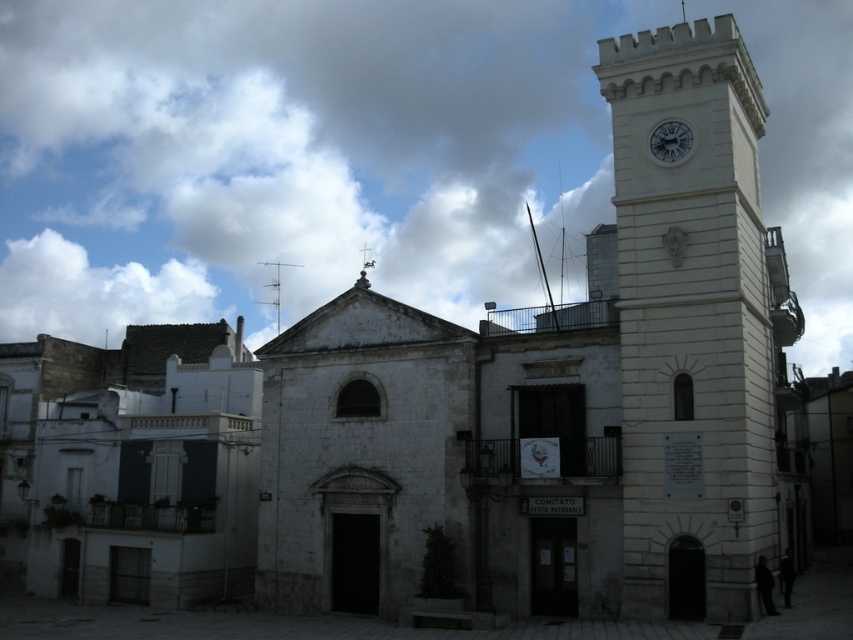
Question: Considering the real-world distances, which object is closest to the silver metallic cross at upper center?

Choices:
 (A) matte white clock at upper right
 (B) white stone clock tower at right

Answer: (A)

Question: Considering the relative positions of white stone clock tower at right and silver metallic cross at upper center in the image provided, where is white stone clock tower at right located with respect to silver metallic cross at upper center?

Choices:
 (A) left
 (B) right

Answer: (B)

Question: Among these points, which one is nearest to the camera?

Choices:
 (A) (718, 440)
 (B) (358, 284)
 (C) (682, 125)

Answer: (A)

Question: Which point is farther to the camera?

Choices:
 (A) (665, 124)
 (B) (636, 344)
 (C) (364, 248)

Answer: (C)

Question: Does matte white clock at upper right appear over silver metallic cross at upper center?

Choices:
 (A) no
 (B) yes

Answer: (B)

Question: Does white stone clock tower at right appear over silver metallic cross at upper center?

Choices:
 (A) yes
 (B) no

Answer: (B)